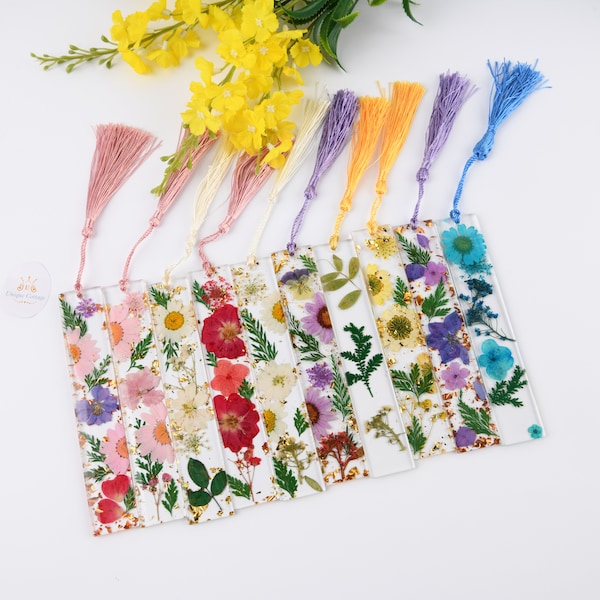
Image resolution: width=600 pixels, height=600 pixels. In order to click on white tassel in this screenshot , I will do `click(223, 155)`, `click(206, 205)`, `click(305, 132)`, `click(295, 162)`.